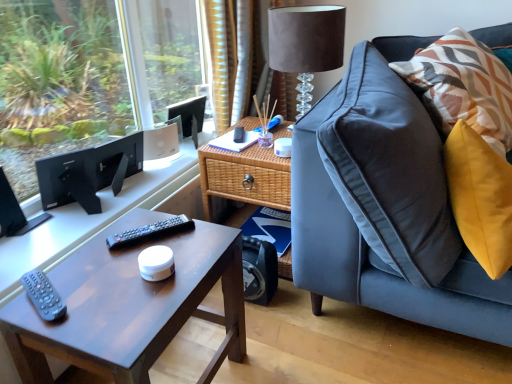
This screenshot has width=512, height=384. Identify the location of free point to the left of black plastic remote at center, which appears as the 2th remote when viewed from the front. 101,244.